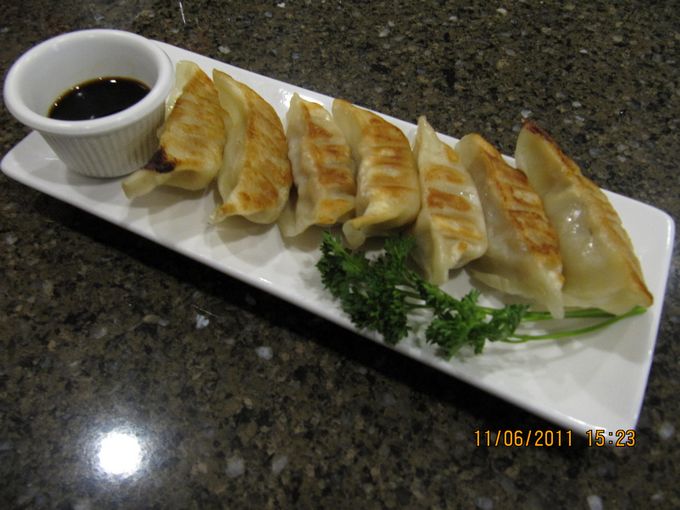
Locate an element on the screen. The height and width of the screenshot is (510, 680). reflection on table is located at coordinates [x=122, y=454].